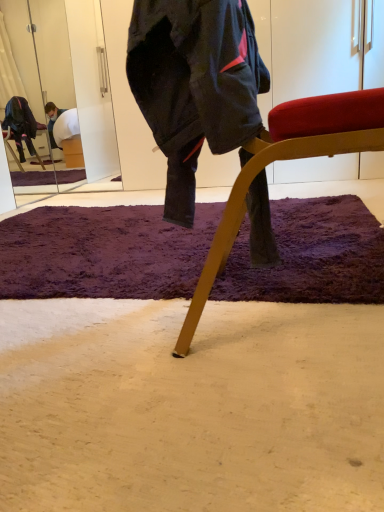
Question: Is purple shaggy rug at center wider or thinner than wooden chair at center?

Choices:
 (A) thin
 (B) wide

Answer: (B)

Question: Considering the relative positions of purple shaggy rug at center and wooden chair at center in the image provided, is purple shaggy rug at center to the left or to the right of wooden chair at center?

Choices:
 (A) left
 (B) right

Answer: (A)

Question: Which object is positioned closest to the dark blue fabric jacket at center?

Choices:
 (A) purple shaggy rug at center
 (B) wooden chair at center

Answer: (B)

Question: Considering the real-world distances, which object is farthest from the wooden chair at center?

Choices:
 (A) dark blue fabric jacket at center
 (B) purple shaggy rug at center

Answer: (B)